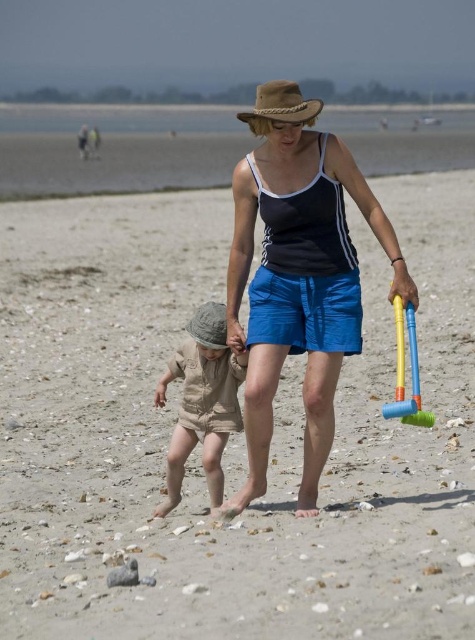
You are a photographer trying to capture the child in the scene. The khaki cotton romper at center and brown straw cowboy hat at center are both in the frame. Which item is closer to the left edge of the photo?

The khaki cotton romper at center is positioned on the left side of brown straw cowboy hat at center, so it is closer to the left edge of the photo.

You are a photographer trying to capture the adult and child walking on the beach. You notice the matte black tank top at center and the khaki cotton romper at center. Which clothing item is positioned higher on the adult or child?

The matte black tank top at center is located above the khaki cotton romper at center, so the matte black tank top at center is positioned higher on the adult or child.